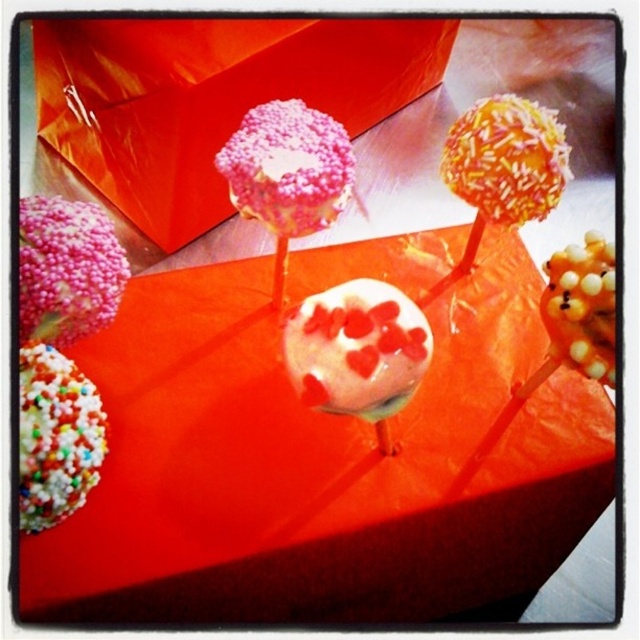
Does multicolored sprinkles at lower left have a larger size compared to white glossy cake pop at center?

Incorrect, multicolored sprinkles at lower left is not larger than white glossy cake pop at center.

Describe the element at coordinates (54, 436) in the screenshot. I see `multicolored sprinkles at lower left` at that location.

Where is `multicolored sprinkles at lower left`? multicolored sprinkles at lower left is located at coordinates (54, 436).

Can you confirm if pink sprinkled candy at center is thinner than yellow pearlized beads at center?

No, pink sprinkled candy at center is not thinner than yellow pearlized beads at center.

Is pink sprinkled candy at center smaller than yellow pearlized beads at center?

No, pink sprinkled candy at center is not smaller than yellow pearlized beads at center.

Between point (64, 200) and point (554, 275), which one is positioned behind?

The point (554, 275) is more distant.

Locate an element on the screen. The width and height of the screenshot is (640, 640). pink sprinkled candy at center is located at coordinates (67, 269).

Is white glossy heart-shaped candy at center to the left of pink sprinkled lollipop at upper center from the viewer's perspective?

No, white glossy heart-shaped candy at center is not to the left of pink sprinkled lollipop at upper center.

You are a GUI agent. You are given a task and a screenshot of the screen. Output one action in this format:
    pyautogui.click(x=<x>, y=<y>)
    Task: Click on the white glossy heart-shaped candy at center
    
    Given the screenshot: What is the action you would take?
    pyautogui.click(x=356, y=348)

Between point (387, 400) and point (328, 188), which one is positioned behind?

Positioned behind is point (328, 188).

You are a GUI agent. You are given a task and a screenshot of the screen. Output one action in this format:
    pyautogui.click(x=<x>, y=<y>)
    Task: Click on the white glossy heart-shaped candy at center
    This screenshot has height=640, width=640.
    Given the screenshot: What is the action you would take?
    pyautogui.click(x=356, y=348)